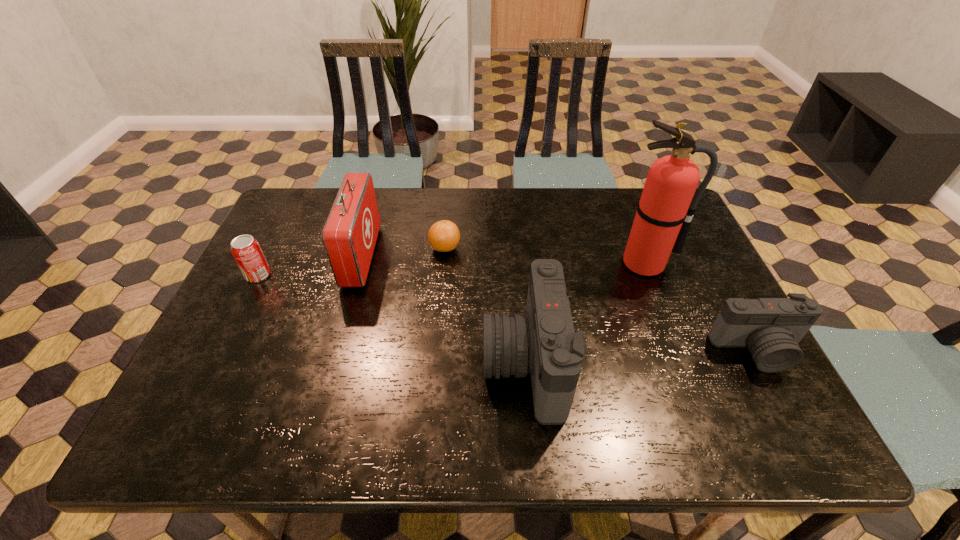
Find the location of a particular element. The image size is (960, 540). fire extinguisher that is at the right edge is located at coordinates (664, 214).

The image size is (960, 540). Identify the location of object that is positioned at the near right corner. (771, 328).

The height and width of the screenshot is (540, 960). Identify the location of free space at the far edge of the desktop. (454, 208).

Where is `vacant space at the near edge of the desktop`? The width and height of the screenshot is (960, 540). vacant space at the near edge of the desktop is located at coordinates (586, 367).

Image resolution: width=960 pixels, height=540 pixels. I want to click on free space at the left edge, so click(273, 322).

Locate an element on the screen. The width and height of the screenshot is (960, 540). blank area at the right edge is located at coordinates (699, 267).

Locate an element on the screen. The image size is (960, 540). vacant region at the far left corner of the desktop is located at coordinates (x=307, y=196).

You are a GUI agent. You are given a task and a screenshot of the screen. Output one action in this format:
    pyautogui.click(x=<x>, y=<y>)
    Task: Click on the free region at the near left corner of the desktop
    Image resolution: width=960 pixels, height=540 pixels.
    Given the screenshot: What is the action you would take?
    pyautogui.click(x=251, y=390)

In order to click on free space at the far right corner in this screenshot , I will do `click(630, 193)`.

The image size is (960, 540). What are the coordinates of `empty location between the second tallest object and the soda can` in the screenshot? It's located at (310, 266).